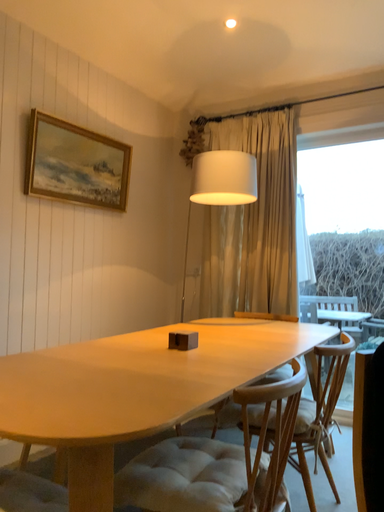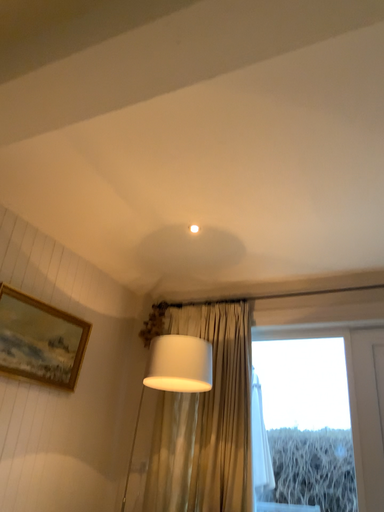
Question: How did the camera likely rotate when shooting the video?

Choices:
 (A) rotated downward
 (B) rotated upward

Answer: (B)